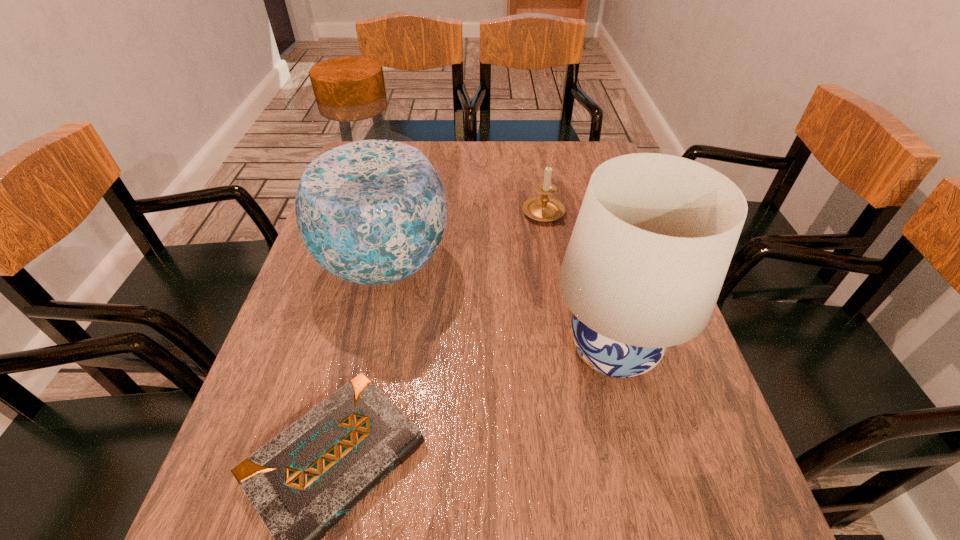
At what (x,y) coordinates should I click in order to perform the action: click on empty space between the third tallest object and the water jug. Please return your answer as a coordinate pair (x, y). The image size is (960, 540). Looking at the image, I should click on (464, 237).

Identify which object is the second closest to the second shortest object. Please provide its 2D coordinates. Your answer should be formatted as a tuple, i.e. [(x, y)], where the tuple contains the x and y coordinates of a point satisfying the conditions above.

[(655, 234)]

Identify which object is the third closest to the tallest object. Please provide its 2D coordinates. Your answer should be formatted as a tuple, i.e. [(x, y)], where the tuple contains the x and y coordinates of a point satisfying the conditions above.

[(655, 234)]